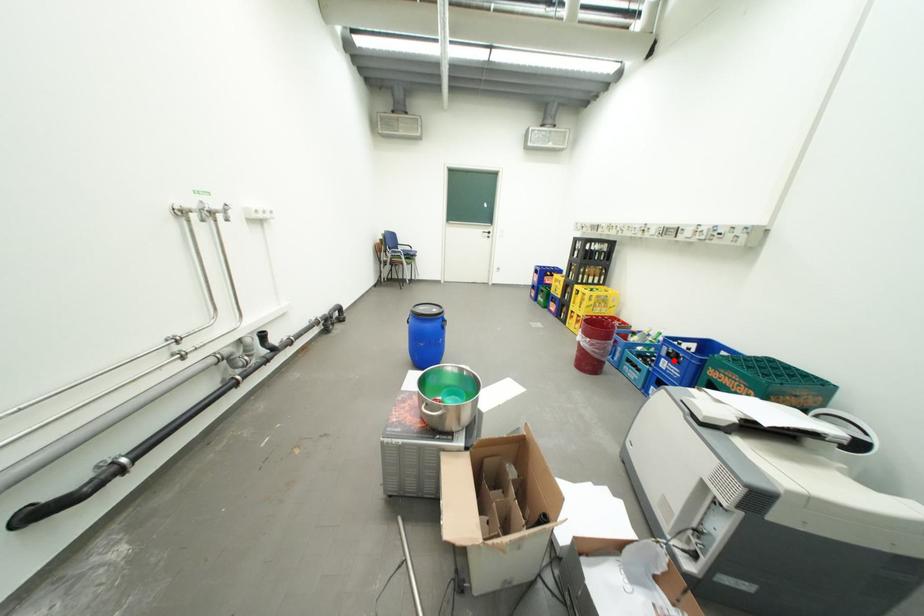
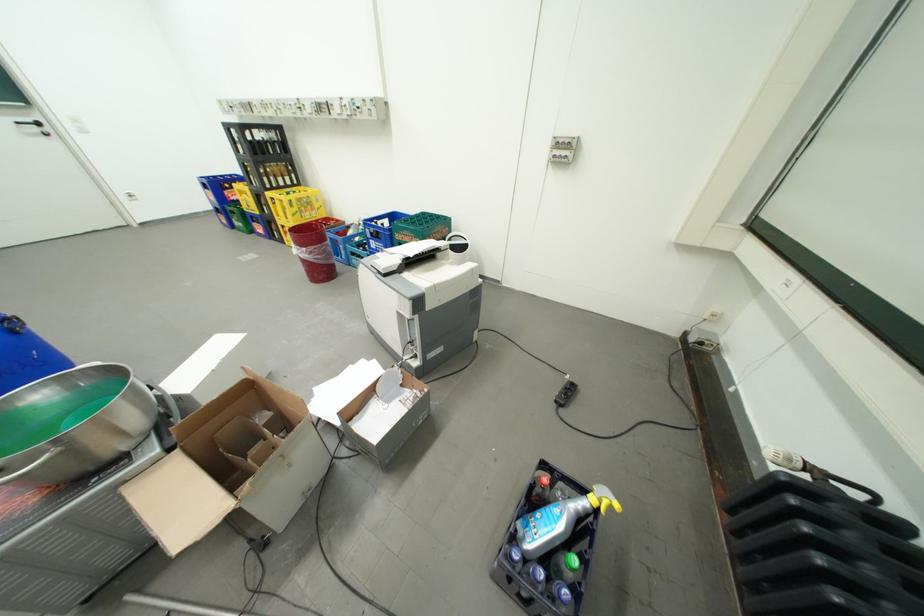
The point at the highlighted location is marked in the first image. Where is the corresponding point in the second image?

(381, 241)